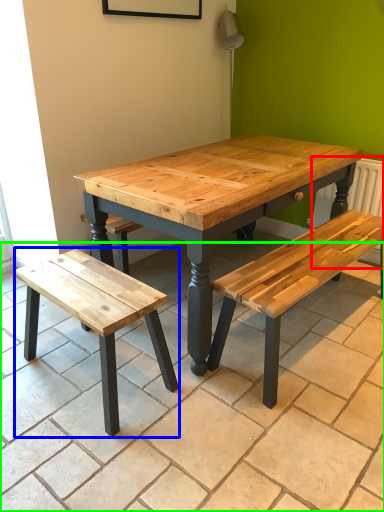
Question: Which object is positioned farthest from radiator (highlighted by a red box)? Select from bench (highlighted by a blue box) and tile (highlighted by a green box).

Choices:
 (A) bench
 (B) tile

Answer: (A)